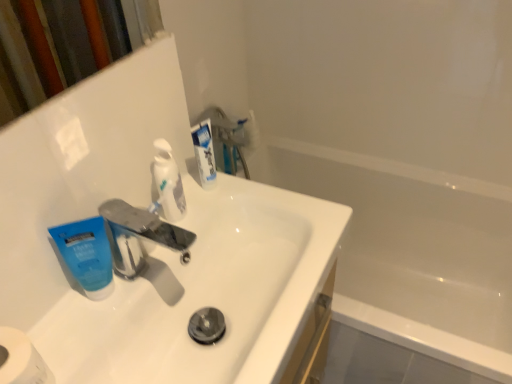
At what (x,y) coordinates should I click in order to perform the action: click on free space in front of blue matte toothpaste at left, which is the third toothpaste from right to left. Please return your answer as a coordinate pair (x, y). The height and width of the screenshot is (384, 512). Looking at the image, I should click on [83, 340].